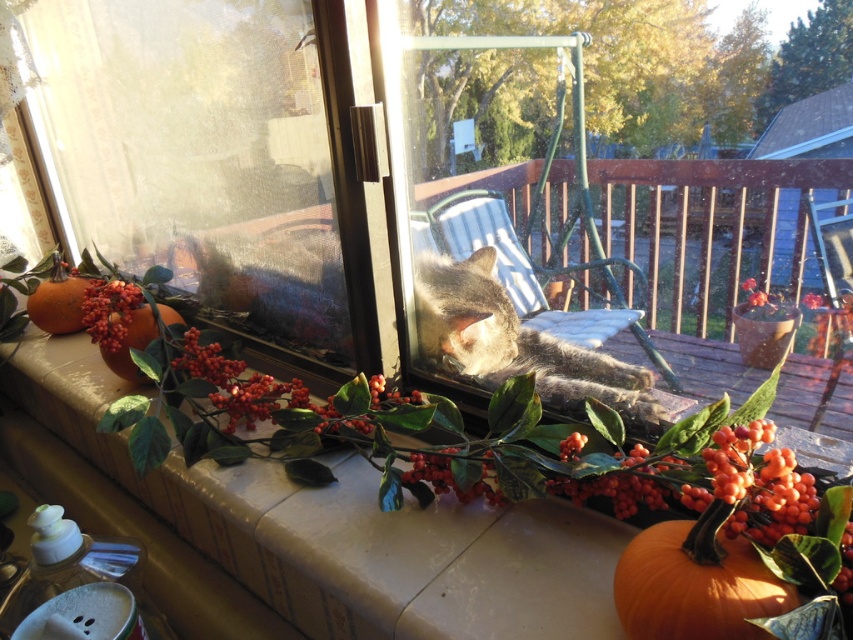
Question: Among these points, which one is farthest from the camera?

Choices:
 (A) (610, 374)
 (B) (712, 508)
 (C) (154, 321)

Answer: (C)

Question: Estimate the real-world distances between objects in this image. Which object is farther from the orange matte pumpkin at left?

Choices:
 (A) smooth stone window sill at lower center
 (B) matte orange pumpkin at lower left
 (C) clear plastic screen door at center
 (D) gray fur cat at center

Answer: (B)

Question: Which object is the farthest from the matte orange pumpkin at left?

Choices:
 (A) matte orange pumpkin at lower left
 (B) translucent glass window at lower left
 (C) orange matte pumpkin at left

Answer: (A)

Question: Can you confirm if smooth stone window sill at lower center is smaller than orange matte pumpkin at left?

Choices:
 (A) yes
 (B) no

Answer: (B)

Question: Is clear plastic screen door at center to the right of matte orange pumpkin at lower left from the viewer's perspective?

Choices:
 (A) yes
 (B) no

Answer: (B)

Question: Can you confirm if smooth stone window sill at lower center is positioned to the left of matte orange pumpkin at left?

Choices:
 (A) no
 (B) yes

Answer: (A)